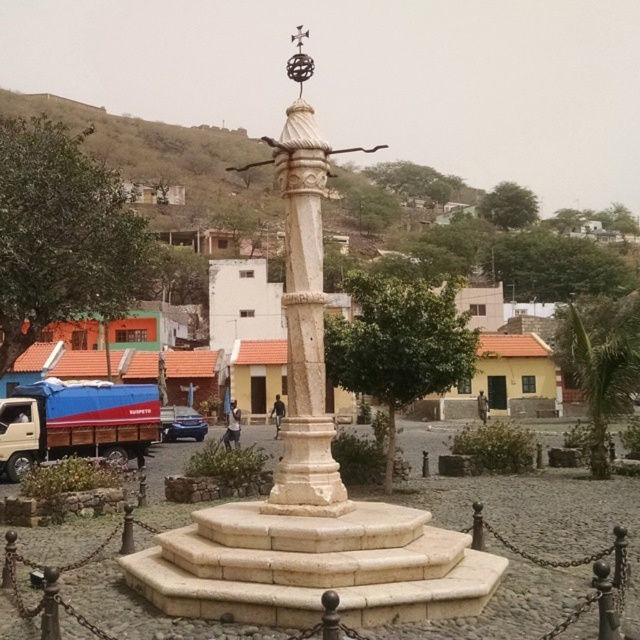
Question: Considering the relative positions of white marble column at center and satin blue sedan at lower left in the image provided, where is white marble column at center located with respect to satin blue sedan at lower left?

Choices:
 (A) left
 (B) right

Answer: (B)

Question: Is white marble column at center wider than satin blue sedan at lower left?

Choices:
 (A) yes
 (B) no

Answer: (A)

Question: Which point appears farthest from the camera in this image?

Choices:
 (A) pyautogui.click(x=307, y=289)
 (B) pyautogui.click(x=177, y=428)

Answer: (B)

Question: Where is white marble column at center located in relation to satin blue sedan at lower left in the image?

Choices:
 (A) below
 (B) above

Answer: (B)

Question: Which object appears farthest from the camera in this image?

Choices:
 (A) white marble column at center
 (B) satin blue sedan at lower left

Answer: (B)